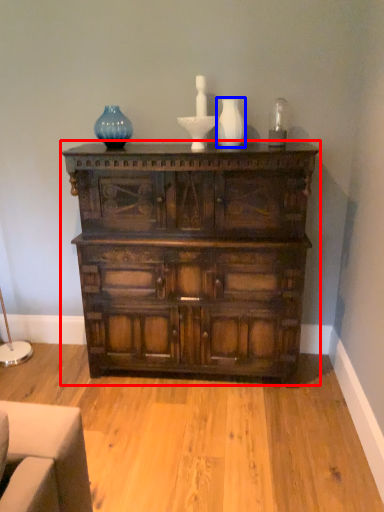
Question: Which of the following is the closest to the observer, chest of drawers (highlighted by a red box) or vase (highlighted by a blue box)?

Choices:
 (A) chest of drawers
 (B) vase

Answer: (A)